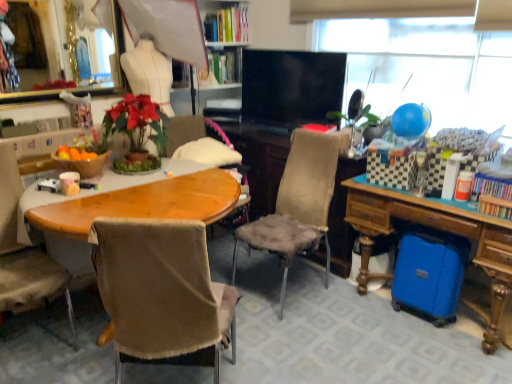
Question: Is blue glossy balloon at upper right not inside brown fabric chair at left, the first chair viewed from the left?

Choices:
 (A) no
 (B) yes

Answer: (B)

Question: Could brown fabric chair at left, the first chair viewed from the left, be considered to be inside blue glossy balloon at upper right?

Choices:
 (A) no
 (B) yes

Answer: (A)

Question: Does blue glossy balloon at upper right have a lesser height compared to brown fabric chair at left, the first chair viewed from the left?

Choices:
 (A) no
 (B) yes

Answer: (B)

Question: Considering the relative sizes of blue glossy balloon at upper right and brown fabric chair at left, which ranks as the third chair in right-to-left order, in the image provided, is blue glossy balloon at upper right smaller than brown fabric chair at left, which ranks as the third chair in right-to-left order,?

Choices:
 (A) no
 (B) yes

Answer: (B)

Question: From a real-world perspective, is blue glossy balloon at upper right physically below brown fabric chair at left, which ranks as the third chair in right-to-left order?

Choices:
 (A) no
 (B) yes

Answer: (A)

Question: Relative to blue matte globe at upper right, is blue glossy balloon at upper right in front or behind?

Choices:
 (A) behind
 (B) front

Answer: (B)

Question: From a real-world perspective, is blue glossy balloon at upper right positioned above or below blue matte globe at upper right?

Choices:
 (A) below
 (B) above

Answer: (A)

Question: Is blue glossy balloon at upper right taller or shorter than blue matte globe at upper right?

Choices:
 (A) short
 (B) tall

Answer: (A)

Question: From the image's perspective, is blue glossy balloon at upper right above or below blue matte globe at upper right?

Choices:
 (A) below
 (B) above

Answer: (A)

Question: From the image's perspective, is black glossy flat-screen tv at center above or below brown fabric chair at center, the second chair viewed from the left?

Choices:
 (A) below
 (B) above

Answer: (B)

Question: Would you say black glossy flat-screen tv at center is to the left or to the right of brown fabric chair at center, marked as the 2th chair in a right-to-left arrangement, in the picture?

Choices:
 (A) right
 (B) left

Answer: (A)

Question: Is black glossy flat-screen tv at center inside the boundaries of brown fabric chair at center, the second chair viewed from the left, or outside?

Choices:
 (A) outside
 (B) inside

Answer: (A)

Question: Is point (274, 66) positioned closer to the camera than point (160, 238)?

Choices:
 (A) closer
 (B) farther

Answer: (B)

Question: Choose the correct answer: Is brown fabric chair at left, the first chair viewed from the left, inside brown fabric chair at center, marked as the 2th chair in a right-to-left arrangement, or outside it?

Choices:
 (A) inside
 (B) outside

Answer: (B)

Question: Considering the positions of brown fabric chair at left, which ranks as the third chair in right-to-left order, and brown fabric chair at center, the second chair viewed from the left, in the image, is brown fabric chair at left, which ranks as the third chair in right-to-left order, taller or shorter than brown fabric chair at center, the second chair viewed from the left,?

Choices:
 (A) tall
 (B) short

Answer: (B)